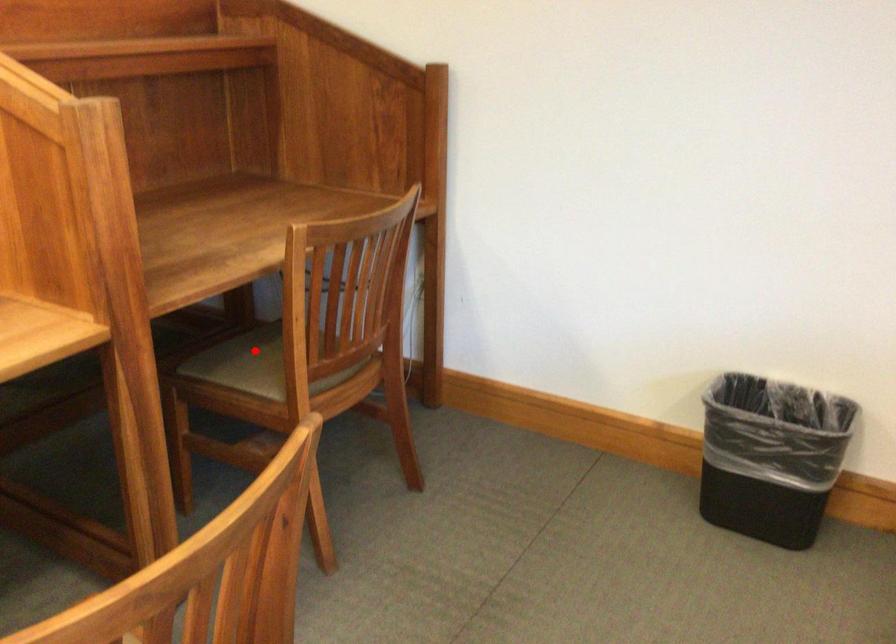
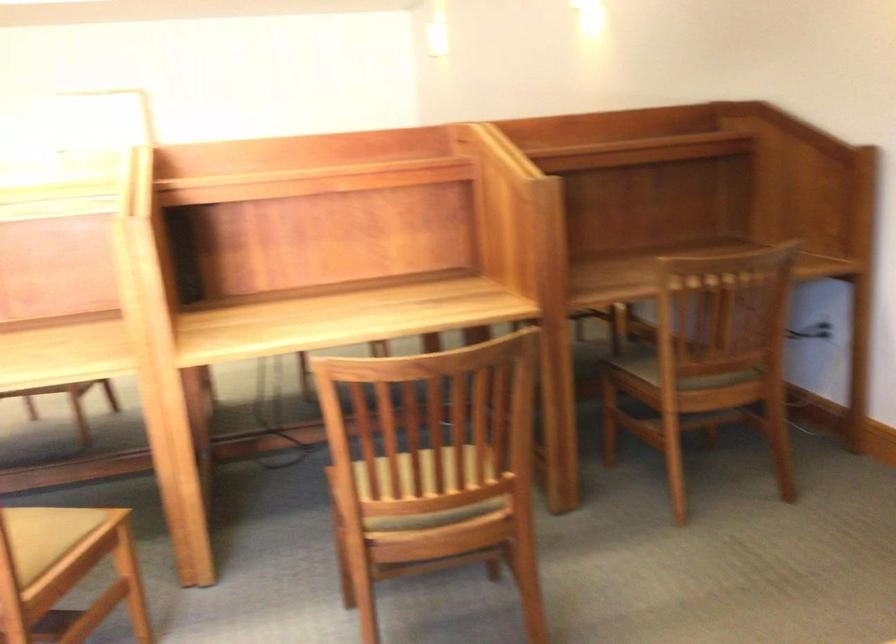
Question: I am providing you with two images of the same scene from different viewpoints. A red point is marked on the first image. At the location where the point appears in image 1, is it still visible in image 2?

Choices:
 (A) Yes
 (B) No

Answer: (B)